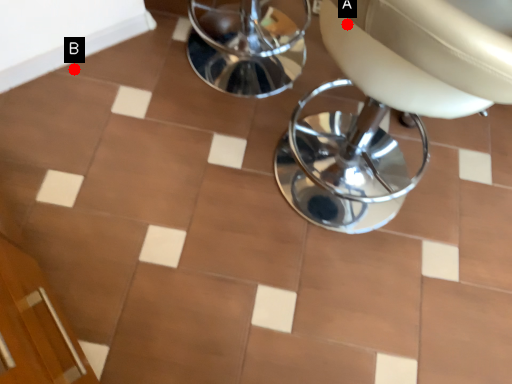
Question: Two points are circled on the image, labeled by A and B beside each circle. Which of the following is the farthest from the observer?

Choices:
 (A) A is further
 (B) B is further

Answer: (B)